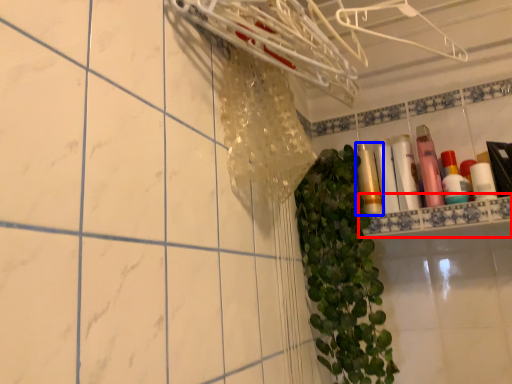
Question: Among these objects, which one is farthest to the camera, ledge (highlighted by a red box) or toiletry (highlighted by a blue box)?

Choices:
 (A) ledge
 (B) toiletry

Answer: (B)